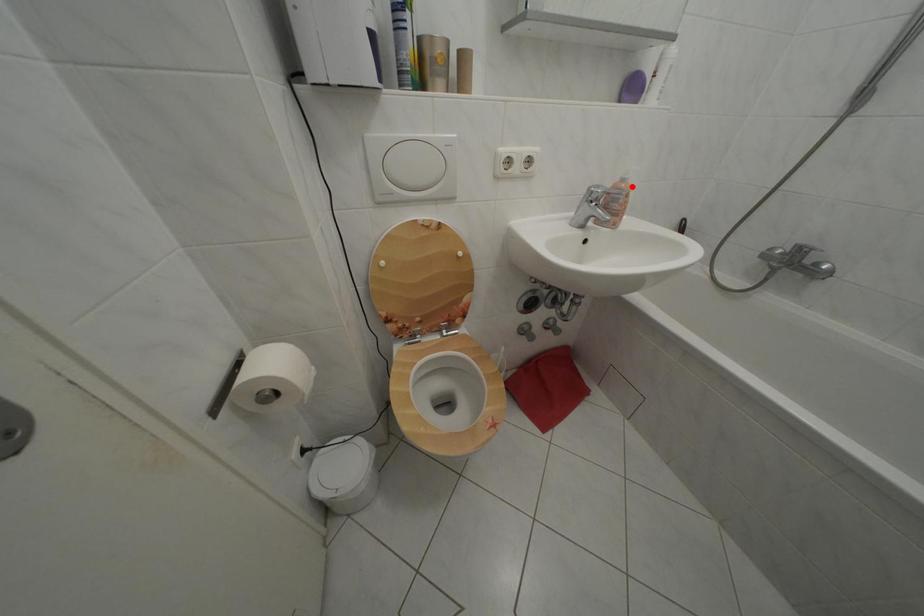
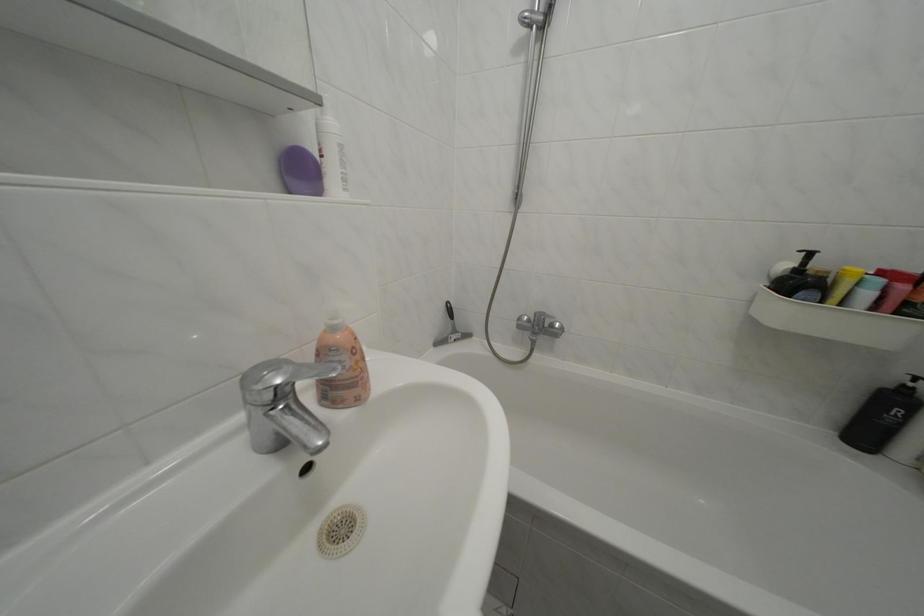
Locate, in the second image, the point that corresponds to the highlighted location in the first image.

(342, 334)